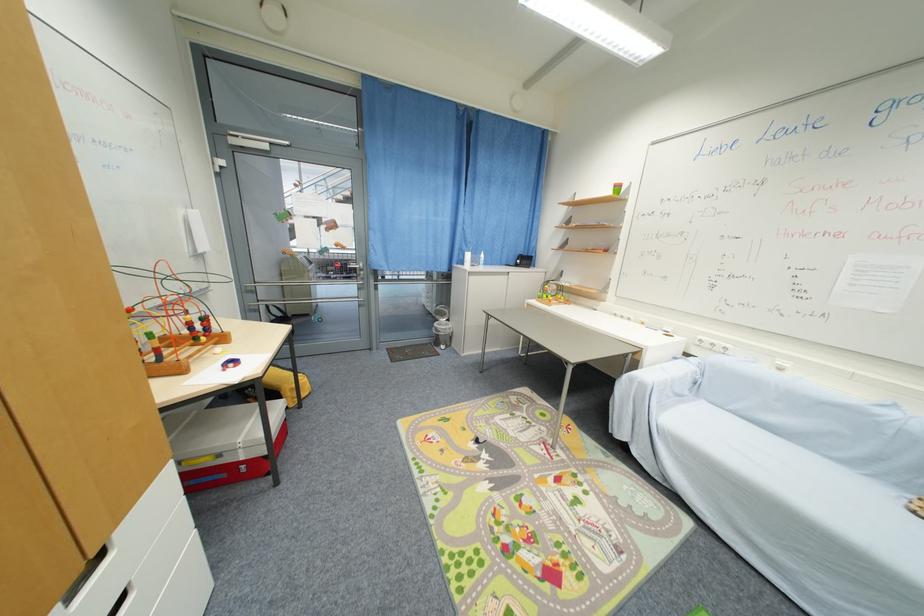
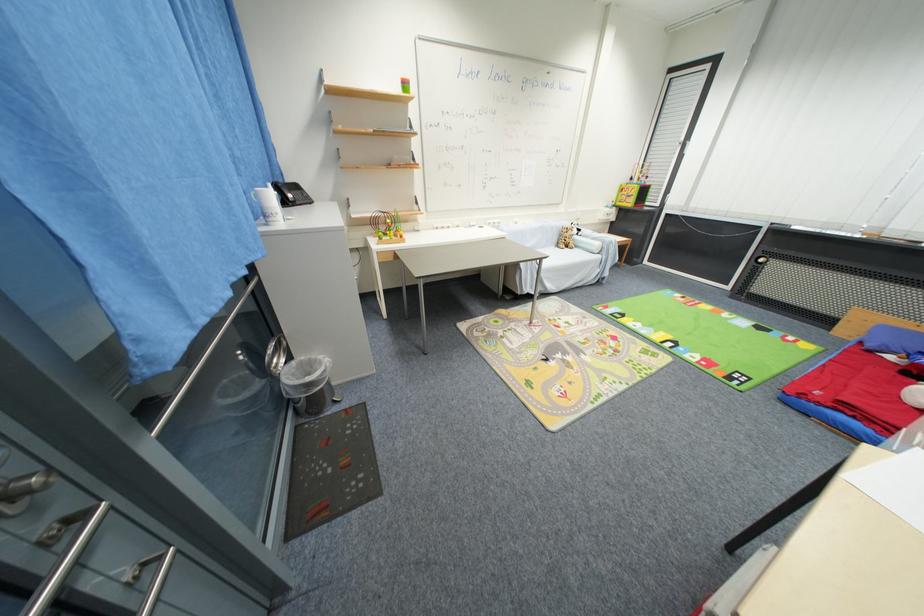
Find the pixel in the second image that matches (454,322) in the first image.

(295, 360)